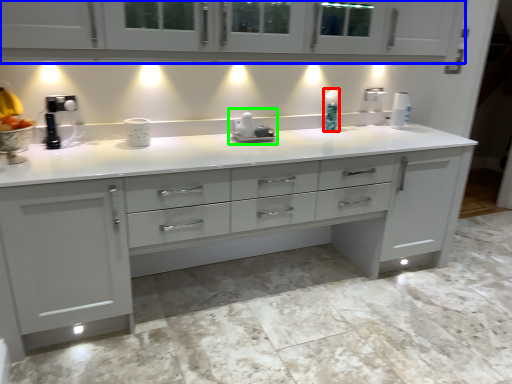
Question: Which is farther away from soap dispenser (highlighted by a red box)? cabinetry (highlighted by a blue box) or appliance (highlighted by a green box)?

Choices:
 (A) cabinetry
 (B) appliance

Answer: (A)